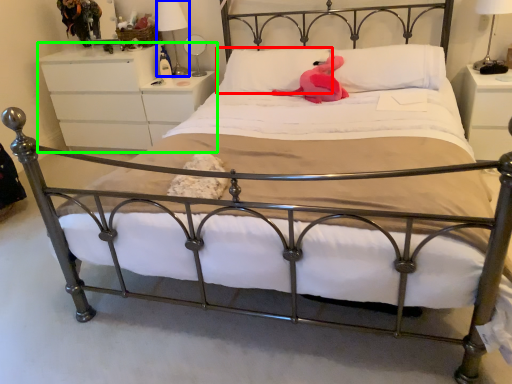
Question: Estimate the real-world distances between objects in this image. Which object is closer to pillow (highlighted by a red box), bedside lamp (highlighted by a blue box) or nightstand (highlighted by a green box)?

Choices:
 (A) bedside lamp
 (B) nightstand

Answer: (B)